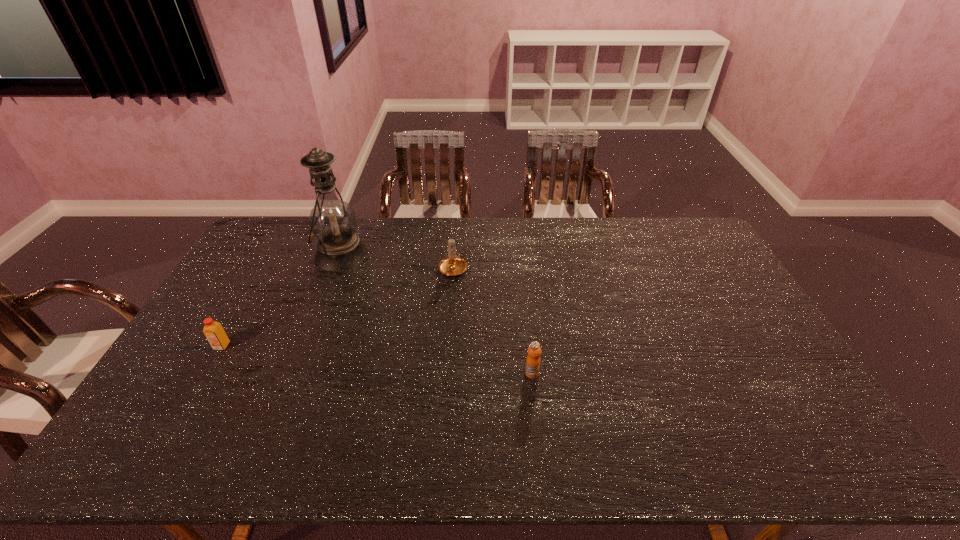
Locate an element on the screen. The height and width of the screenshot is (540, 960). the tallest object is located at coordinates (332, 221).

Locate an element on the screen. oil lamp is located at coordinates (332, 221).

Locate an element on the screen. The image size is (960, 540). the second object from right to left is located at coordinates pos(452,265).

Where is `the rightmost object`? the rightmost object is located at coordinates (533, 360).

Where is `the right orange juice`? The height and width of the screenshot is (540, 960). the right orange juice is located at coordinates (533, 360).

Where is `the third farthest object`? This screenshot has height=540, width=960. the third farthest object is located at coordinates (213, 331).

Find the location of a particular element. This screenshot has height=540, width=960. the left orange juice is located at coordinates (213, 331).

Where is `vacant region located on the left of the oil lamp`? The height and width of the screenshot is (540, 960). vacant region located on the left of the oil lamp is located at coordinates (263, 254).

I want to click on free space located 0.350m on the front of the third object from left to right, so point(446,362).

The width and height of the screenshot is (960, 540). What are the coordinates of `free spot located on the front label of the rightmost object` in the screenshot? It's located at (536, 408).